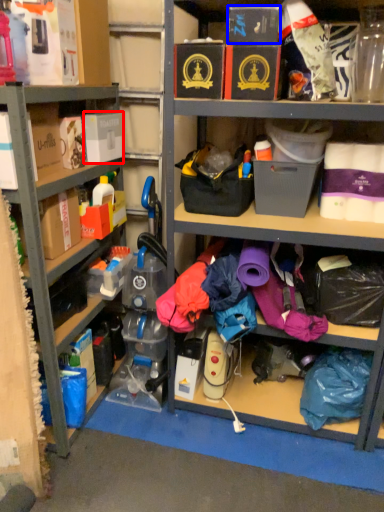
Question: Which object is closer to the camera taking this photo, storage box (highlighted by a red box) or storage box (highlighted by a blue box)?

Choices:
 (A) storage box
 (B) storage box

Answer: (B)